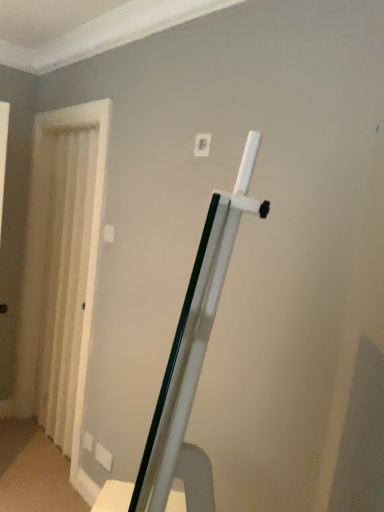
Question: Is white textured curtain at left in front of or behind white plastic light switch at upper center in the image?

Choices:
 (A) behind
 (B) front

Answer: (A)

Question: In terms of height, does white textured curtain at left look taller or shorter compared to white plastic light switch at upper center?

Choices:
 (A) short
 (B) tall

Answer: (B)

Question: Based on their sizes in the image, would you say white textured curtain at left is bigger or smaller than white plastic light switch at upper center?

Choices:
 (A) big
 (B) small

Answer: (A)

Question: In the image, is white plastic light switch at upper center on the left side or the right side of white textured curtain at left?

Choices:
 (A) left
 (B) right

Answer: (B)

Question: In terms of height, does white plastic light switch at upper center look taller or shorter compared to white textured curtain at left?

Choices:
 (A) tall
 (B) short

Answer: (B)

Question: In terms of width, does white plastic light switch at upper center look wider or thinner when compared to white textured curtain at left?

Choices:
 (A) thin
 (B) wide

Answer: (A)

Question: Does point (200, 137) appear closer or farther from the camera than point (79, 206)?

Choices:
 (A) farther
 (B) closer

Answer: (B)